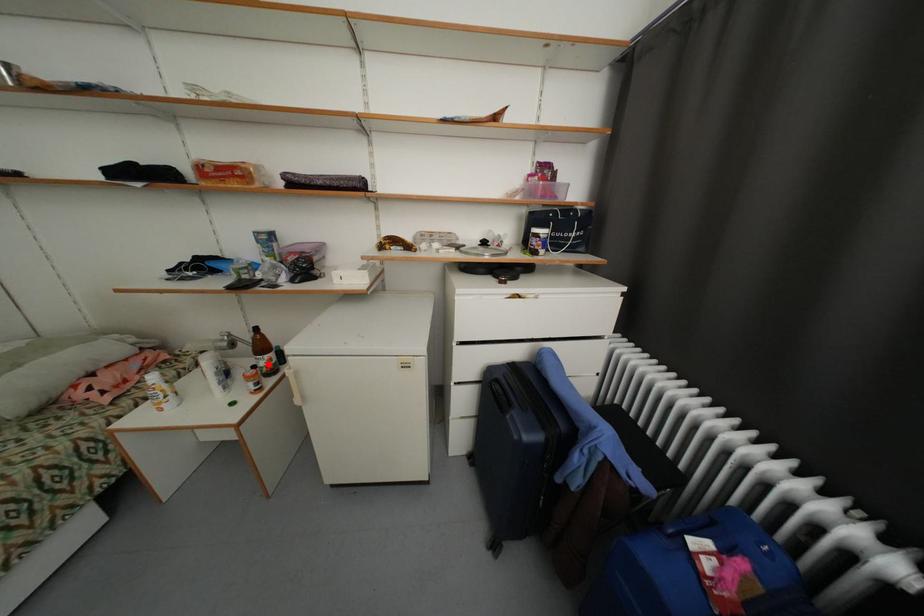
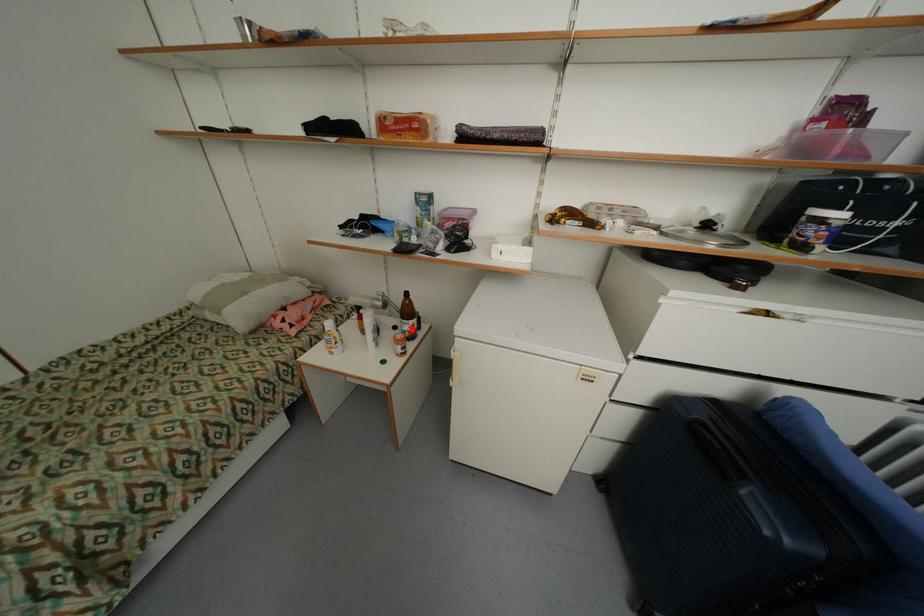
I am providing you with two images of the same scene from different viewpoints. A red point is marked on the first image and another point is marked on the second image. Is the marked point in image1 the same physical position as the marked point in image2?

Yes